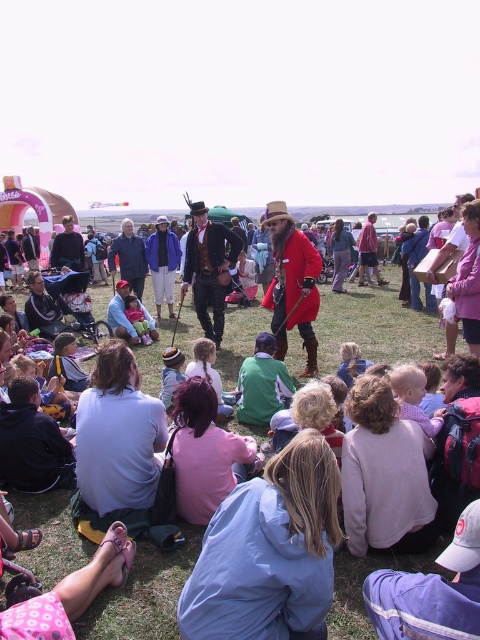
You are a photographer at the event and want to capture a photo of both the red velvet coat at center and the blue fabric jacket at lower center. Which object is positioned higher in the image?

The red velvet coat at center is positioned higher than the blue fabric jacket at lower center.

You are at the festival and want to find the white cotton shirt at lower left. Which direction should you look relative to the red velvet coat at center?

The white cotton shirt at lower left is located to the left of the red velvet coat at center.

You are a photographer at the event and want to capture a photo that includes both the red velvet coat at center and the white cotton shirt at lower left. Which object should you focus on first to ensure both are in the frame?

You should focus on the red velvet coat at center first because it is taller than the white cotton shirt at lower left, so adjusting the frame to include its height will naturally include the shorter white cotton shirt at lower left as well.